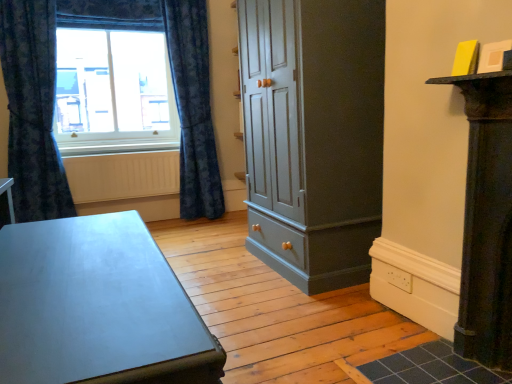
Question: Should I look upward or downward to see blue textured curtain at left, which is counted as the 1th curtain, starting from the right?

Choices:
 (A) up
 (B) down

Answer: (A)

Question: Is dark blue textured curtain at left, which appears as the 2th curtain when viewed from the right, in contact with white textured radiator at lower left?

Choices:
 (A) no
 (B) yes

Answer: (A)

Question: Is dark blue textured curtain at left, which appears as the 2th curtain when viewed from the right, wider than white textured radiator at lower left?

Choices:
 (A) no
 (B) yes

Answer: (B)

Question: Is dark blue textured curtain at left, which is the 1th curtain from left to right, oriented away from white textured radiator at lower left?

Choices:
 (A) yes
 (B) no

Answer: (B)

Question: Can you confirm if dark blue textured curtain at left, which is the 1th curtain from left to right, is shorter than white textured radiator at lower left?

Choices:
 (A) no
 (B) yes

Answer: (A)

Question: From a real-world perspective, is dark blue textured curtain at left, which appears as the 2th curtain when viewed from the right, located beneath white textured radiator at lower left?

Choices:
 (A) no
 (B) yes

Answer: (A)

Question: From the image's perspective, does dark blue textured curtain at left, which appears as the 2th curtain when viewed from the right, appear higher than white textured radiator at lower left?

Choices:
 (A) no
 (B) yes

Answer: (B)

Question: Does matte glass window at upper left have a greater height compared to white textured radiator at lower left?

Choices:
 (A) no
 (B) yes

Answer: (B)

Question: Does matte glass window at upper left appear on the left side of white textured radiator at lower left?

Choices:
 (A) yes
 (B) no

Answer: (A)

Question: Can you confirm if matte glass window at upper left is smaller than white textured radiator at lower left?

Choices:
 (A) yes
 (B) no

Answer: (B)

Question: Is matte glass window at upper left positioned before white textured radiator at lower left?

Choices:
 (A) yes
 (B) no

Answer: (A)

Question: Considering the relative sizes of matte glass window at upper left and white textured radiator at lower left in the image provided, is matte glass window at upper left shorter than white textured radiator at lower left?

Choices:
 (A) no
 (B) yes

Answer: (A)

Question: From a real-world perspective, is matte glass window at upper left on white textured radiator at lower left?

Choices:
 (A) yes
 (B) no

Answer: (A)

Question: Is matte glass window at upper left at the right side of matte gray table at lower left?

Choices:
 (A) yes
 (B) no

Answer: (B)